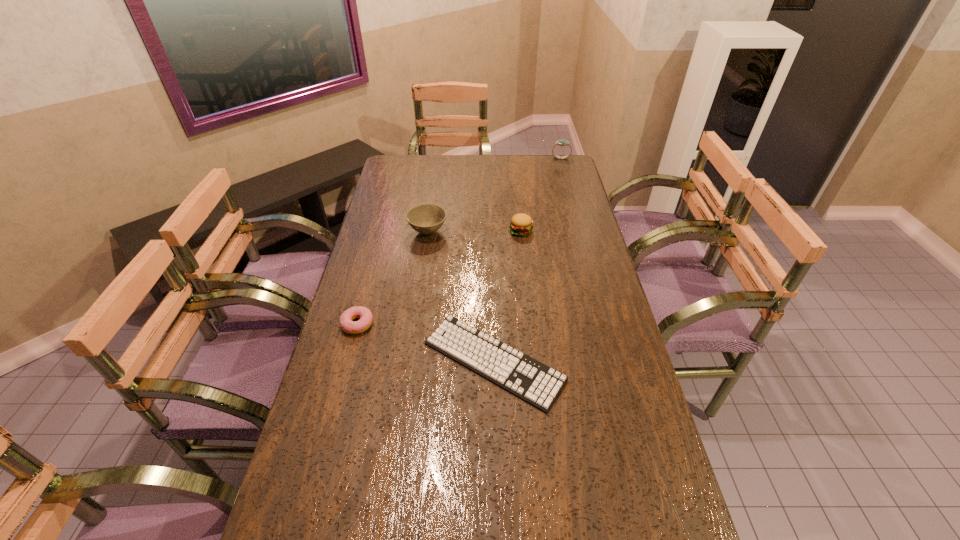
I want to click on free point between the bowl and the leftmost object, so pyautogui.click(x=393, y=278).

Locate which object is the fourth closest to the second shortest object. Please provide its 2D coordinates. Your answer should be formatted as a tuple, i.e. [(x, y)], where the tuple contains the x and y coordinates of a point satisfying the conditions above.

[(561, 142)]

Where is `object that is the closest one to the hamburger`? The height and width of the screenshot is (540, 960). object that is the closest one to the hamburger is located at coordinates (427, 218).

You are a GUI agent. You are given a task and a screenshot of the screen. Output one action in this format:
    pyautogui.click(x=<x>, y=<y>)
    Task: Click on the free location that satisfies the following two spatial constraints: 1. on the back side of the third tallest object; 2. on the left side of the watch
    Image resolution: width=960 pixels, height=540 pixels.
    Given the screenshot: What is the action you would take?
    pyautogui.click(x=513, y=158)

At what (x,y) coordinates should I click in order to perform the action: click on vacant region that satisfies the following two spatial constraints: 1. on the back side of the third shortest object; 2. on the left side of the farthest object. Please return your answer as a coordinate pair (x, y). The image size is (960, 540). Looking at the image, I should click on (513, 158).